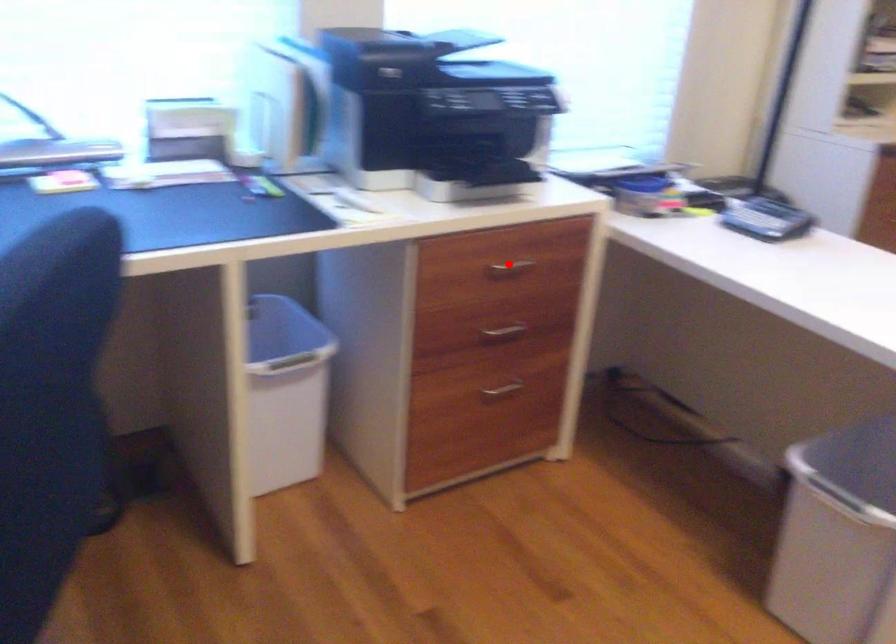
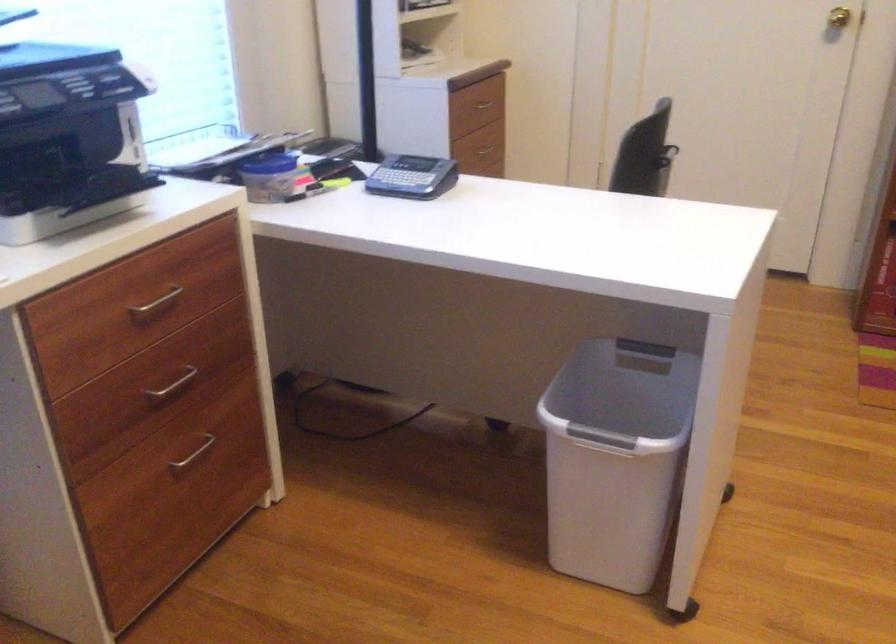
Question: I am providing you with two images of the same scene from different viewpoints. Given a red point in image1, look at the same physical point in image2. Is it:

Choices:
 (A) Closer to the viewpoint
 (B) Farther from the viewpoint

Answer: (A)